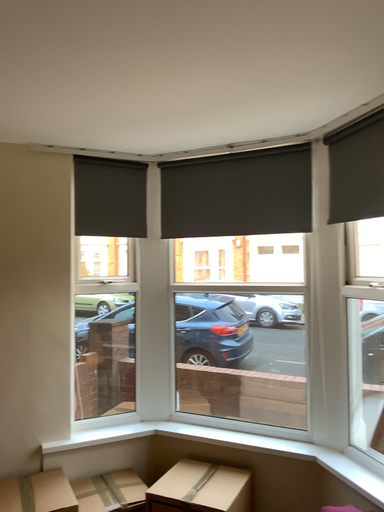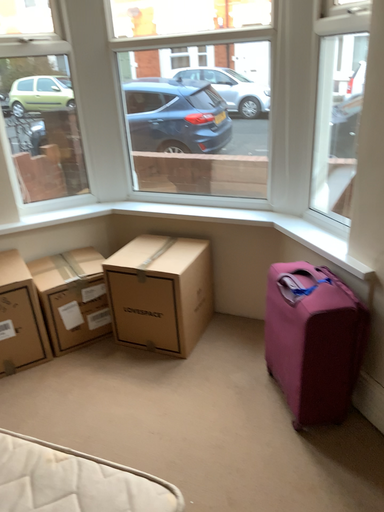
Question: How did the camera likely rotate when shooting the video?

Choices:
 (A) rotated downward
 (B) rotated upward

Answer: (A)